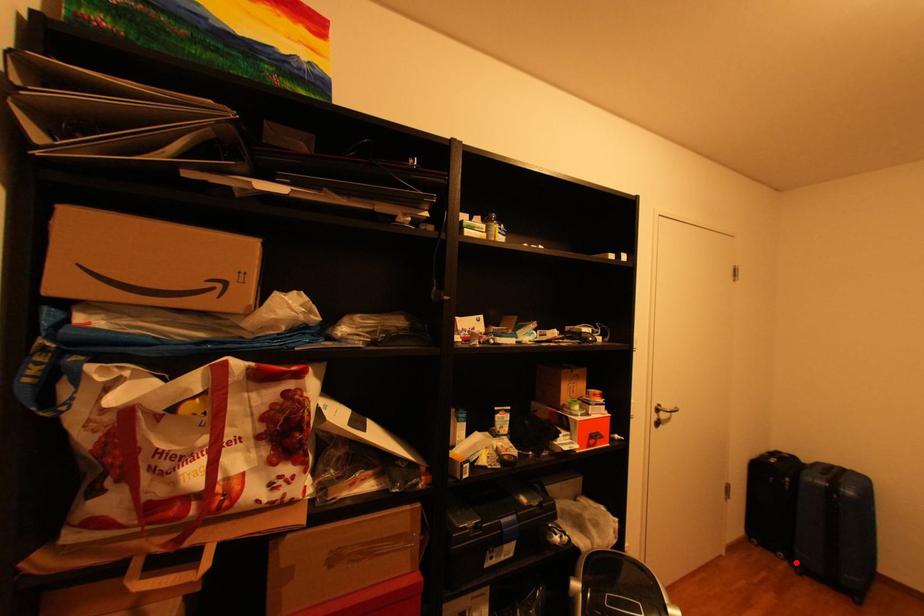
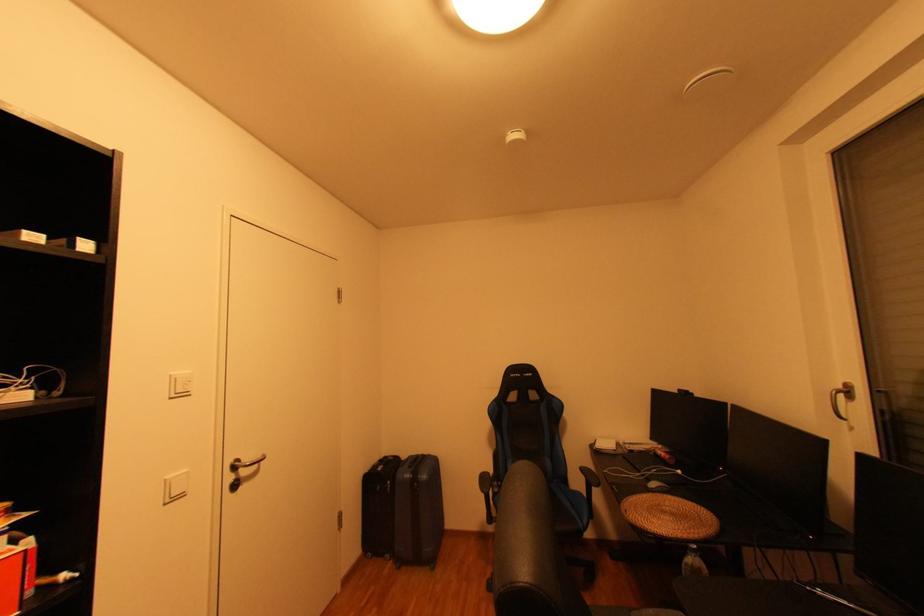
Question: I am providing you with two images of the same scene from different viewpoints. A red point is shown in image1. For the corresponding object point in image2, is it positioned nearer or farther from the camera?

Choices:
 (A) Nearer
 (B) Farther

Answer: (B)